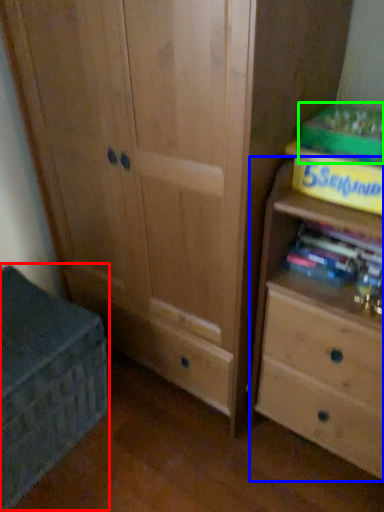
Question: Which object is positioned closest to cabinetry (highlighted by a red box)? Select from chest of drawers (highlighted by a blue box) and paperback book (highlighted by a green box).

Choices:
 (A) chest of drawers
 (B) paperback book

Answer: (A)